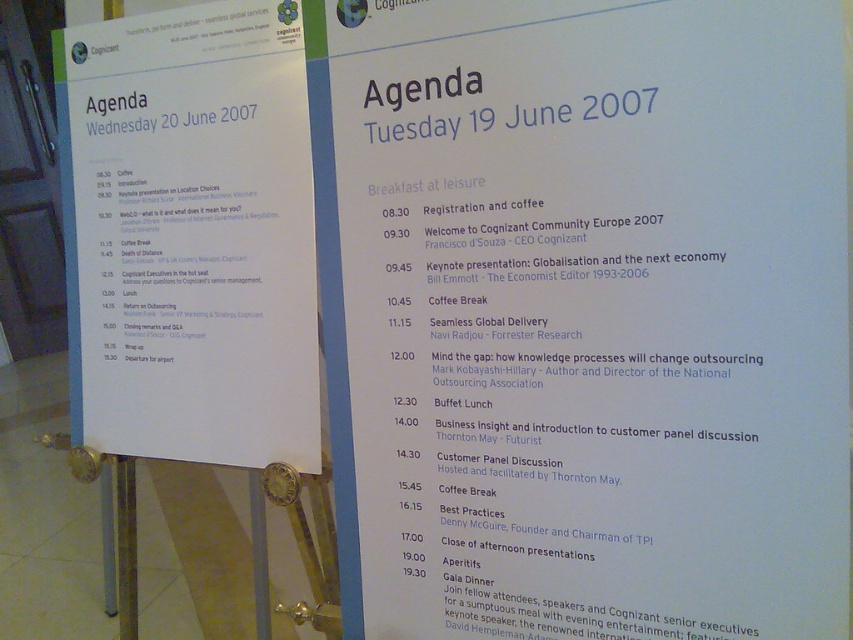
In the scene shown: Does white paper agenda at upper center have a greater width compared to white paper agenda at upper left?

Correct, the width of white paper agenda at upper center exceeds that of white paper agenda at upper left.

Is white paper agenda at upper center taller than white paper agenda at upper left?

Yes, white paper agenda at upper center is taller than white paper agenda at upper left.

Does point (811, 93) come in front of point (144, 451)?

Yes, it is in front of point (144, 451).

The width and height of the screenshot is (853, 640). In order to click on white paper agenda at upper center in this screenshot , I will do `click(595, 316)`.